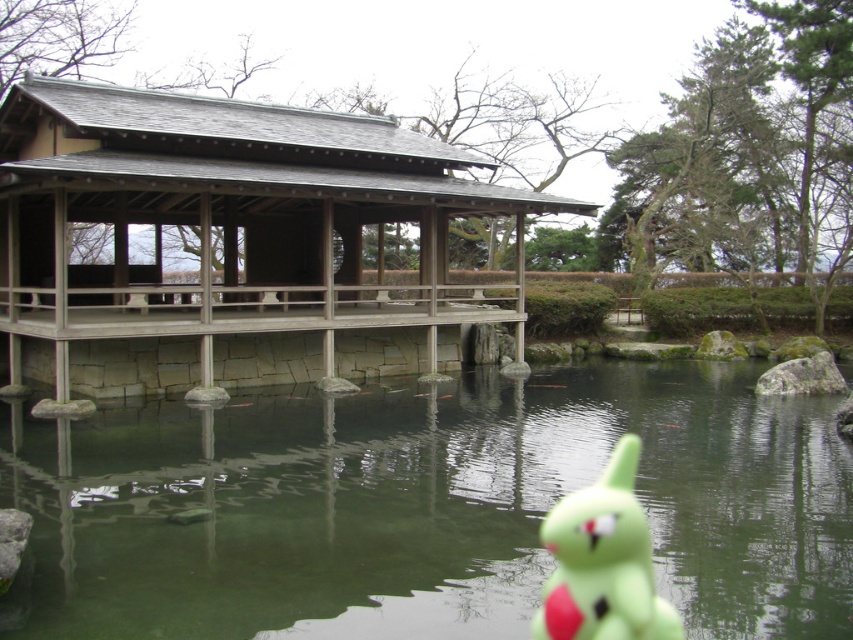
Question: Estimate the real-world distances between objects in this image. Which object is farther from the wooden/stone pavilion at center?

Choices:
 (A) green translucent water at center
 (B) green rubber toy at lower right

Answer: (B)

Question: Estimate the real-world distances between objects in this image. Which object is farther from the green translucent water at center?

Choices:
 (A) green rubber toy at lower right
 (B) wooden/stone pavilion at center

Answer: (A)

Question: Based on their relative distances, which object is nearer to the wooden/stone pavilion at center?

Choices:
 (A) green translucent water at center
 (B) green rubber toy at lower right

Answer: (A)

Question: Can you confirm if green translucent water at center is wider than wooden/stone pavilion at center?

Choices:
 (A) yes
 (B) no

Answer: (B)

Question: Does green translucent water at center have a lesser width compared to green rubber toy at lower right?

Choices:
 (A) no
 (B) yes

Answer: (A)

Question: From the image, what is the correct spatial relationship of wooden/stone pavilion at center in relation to green rubber toy at lower right?

Choices:
 (A) above
 (B) below

Answer: (A)